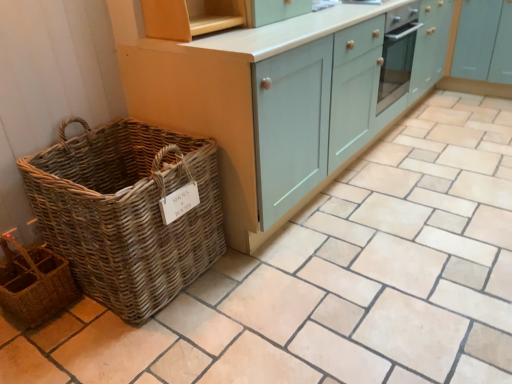
Question: Does matte teal cabinet at center, which is the second cabinetry from right to left, come behind rustic wicker basket at lower left?

Choices:
 (A) no
 (B) yes

Answer: (B)

Question: Is matte teal cabinet at center, which is counted as the first cabinetry, starting from the left, beside rustic wicker basket at lower left?

Choices:
 (A) yes
 (B) no

Answer: (B)

Question: Is matte teal cabinet at center, which is the second cabinetry from right to left, smaller than rustic wicker basket at lower left?

Choices:
 (A) yes
 (B) no

Answer: (B)

Question: Is matte teal cabinet at center, which is the second cabinetry from right to left, closer to the viewer compared to rustic wicker basket at lower left?

Choices:
 (A) no
 (B) yes

Answer: (A)

Question: Can you confirm if matte teal cabinet at center, which is counted as the first cabinetry, starting from the left, is positioned to the right of rustic wicker basket at lower left?

Choices:
 (A) yes
 (B) no

Answer: (A)

Question: In terms of size, does rustic wicker basket at lower left appear bigger or smaller than wooden shelf at upper center?

Choices:
 (A) small
 (B) big

Answer: (B)

Question: From the image's perspective, is rustic wicker basket at lower left positioned above or below wooden shelf at upper center?

Choices:
 (A) below
 (B) above

Answer: (A)

Question: Is rustic wicker basket at lower left in front of or behind wooden shelf at upper center in the image?

Choices:
 (A) front
 (B) behind

Answer: (A)

Question: Considering the positions of rustic wicker basket at lower left and wooden shelf at upper center in the image, is rustic wicker basket at lower left wider or thinner than wooden shelf at upper center?

Choices:
 (A) wide
 (B) thin

Answer: (B)

Question: From a real-world perspective, is matte teal cabinet at center, which is counted as the first cabinetry, starting from the left, positioned above or below rustic wicker basket at lower left?

Choices:
 (A) below
 (B) above

Answer: (B)

Question: From their relative heights in the image, would you say matte teal cabinet at center, which is counted as the first cabinetry, starting from the left, is taller or shorter than rustic wicker basket at lower left?

Choices:
 (A) short
 (B) tall

Answer: (B)

Question: From the image's perspective, is matte teal cabinet at center, which is counted as the first cabinetry, starting from the left, positioned above or below rustic wicker basket at lower left?

Choices:
 (A) below
 (B) above

Answer: (B)

Question: Visually, is matte teal cabinet at center, which is counted as the first cabinetry, starting from the left, positioned to the left or to the right of rustic wicker basket at lower left?

Choices:
 (A) left
 (B) right

Answer: (B)

Question: Choose the correct answer: Is rustic wicker basket at lower left inside matte teal cabinet at center, which is the second cabinetry from right to left, or outside it?

Choices:
 (A) inside
 (B) outside

Answer: (B)

Question: Considering their positions, is rustic wicker basket at lower left located in front of or behind matte teal cabinet at center, which is counted as the first cabinetry, starting from the left?

Choices:
 (A) behind
 (B) front

Answer: (B)